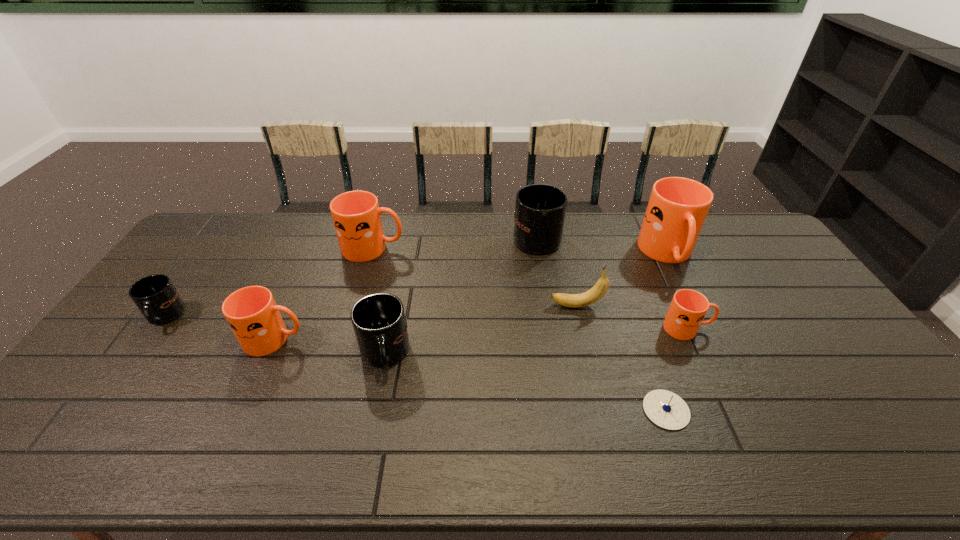
Find the location of a particular element. The image size is (960, 540). vacant space that satisfies the following two spatial constraints: 1. with the handle on the side of the third object from right to left; 2. on the right side of the second smallest black mug is located at coordinates (373, 410).

The width and height of the screenshot is (960, 540). I want to click on vacant point that satisfies the following two spatial constraints: 1. at the start of the peel on the third object from right to left; 2. on the left side of the banana, so click(x=601, y=410).

Where is `free spot that satisfies the following two spatial constraints: 1. at the start of the peel on the banana; 2. on the right side of the blue compass`? The width and height of the screenshot is (960, 540). free spot that satisfies the following two spatial constraints: 1. at the start of the peel on the banana; 2. on the right side of the blue compass is located at coordinates (601, 410).